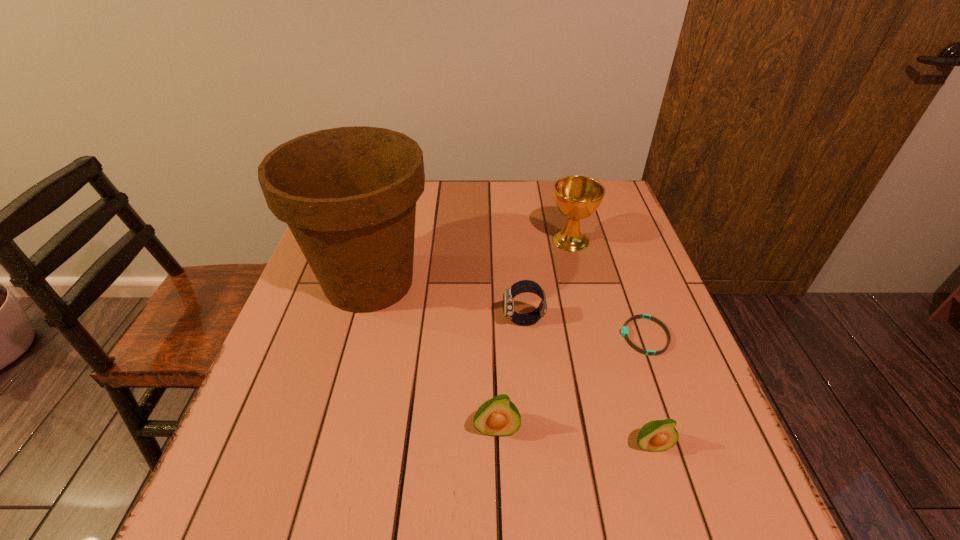
Please point a vacant point for placing a avocado on the left. Please provide its 2D coordinates. Your answer should be formatted as a tuple, i.e. [(x, y)], where the tuple contains the x and y coordinates of a point satisfying the conditions above.

[(350, 413)]